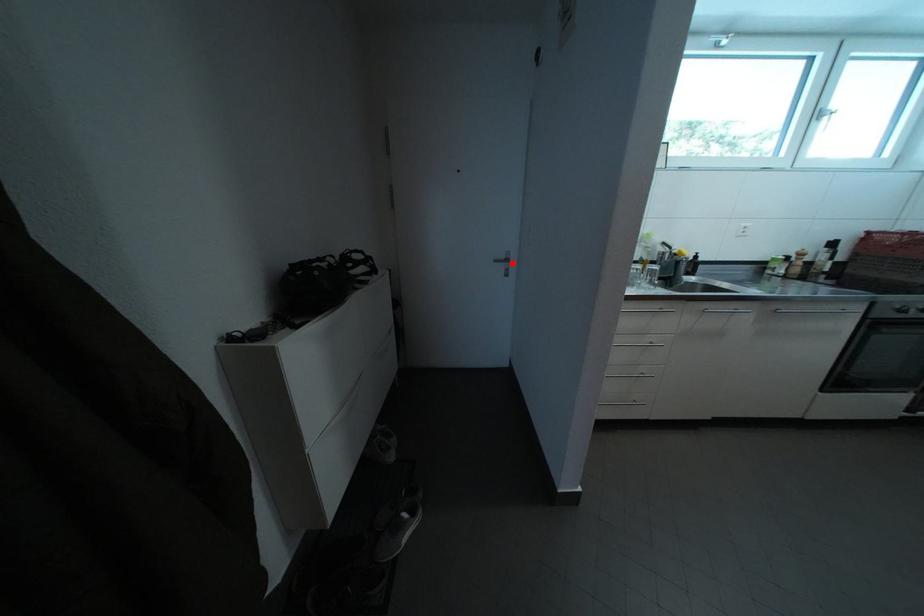
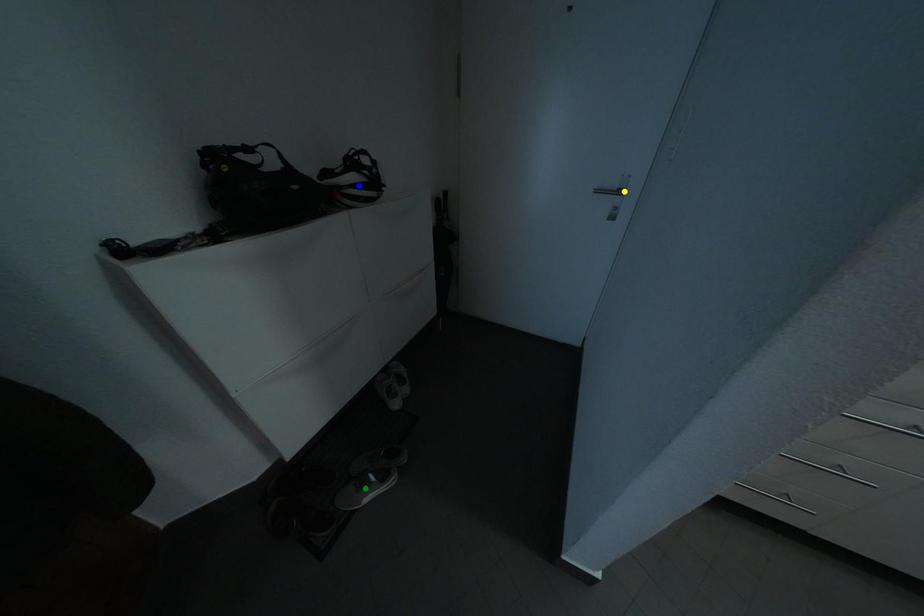
Question: I am providing you with two images of the same scene from different viewpoints. A red point is marked on the first image. You are given multiple points on the second image. Which mark in image 2 goes with the point in image 1?

Choices:
 (A) yellow point
 (B) green point
 (C) blue point

Answer: (A)